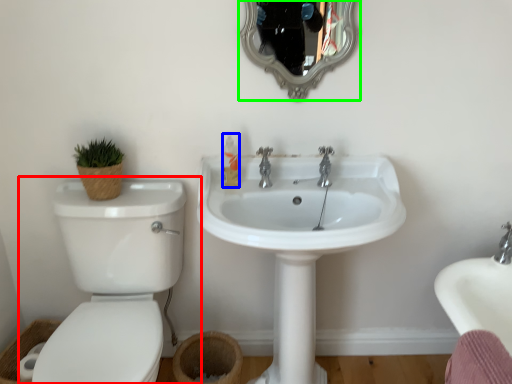
Question: Which is nearer to the toilet (highlighted by a red box)? toiletry (highlighted by a blue box) or mirror (highlighted by a green box).

Choices:
 (A) toiletry
 (B) mirror

Answer: (A)